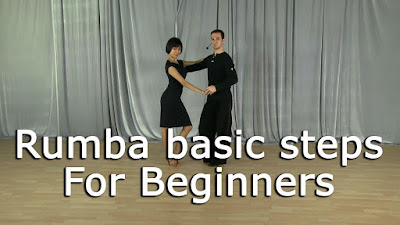
Locate an element on the screen. light brown wooden surface is located at coordinates (367, 197).